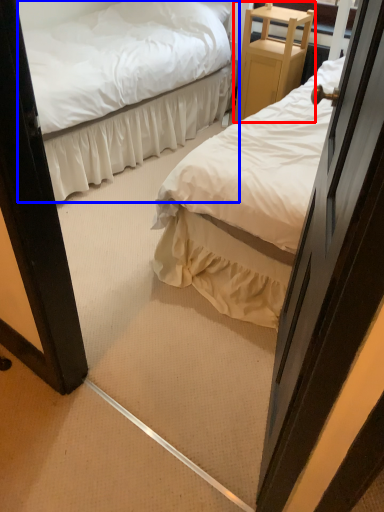
Question: Which of the following is the closest to the observer, furniture (highlighted by a red box) or bed (highlighted by a blue box)?

Choices:
 (A) furniture
 (B) bed

Answer: (B)